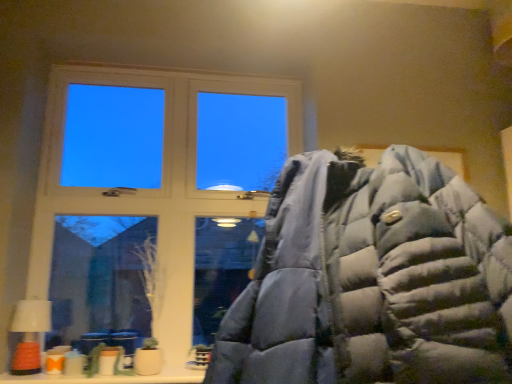
Question: From a real-world perspective, is orange matte lampshade at lower left above or below matte blue puffer jacket at center?

Choices:
 (A) above
 (B) below

Answer: (B)

Question: Based on their sizes in the image, would you say orange matte lampshade at lower left is bigger or smaller than matte blue puffer jacket at center?

Choices:
 (A) small
 (B) big

Answer: (A)

Question: Which of these objects is positioned farthest from the white wood window at upper left?

Choices:
 (A) orange matte lampshade at lower left
 (B) matte blue puffer jacket at center

Answer: (B)

Question: Estimate the real-world distances between objects in this image. Which object is closer to the matte blue puffer jacket at center?

Choices:
 (A) orange matte lampshade at lower left
 (B) white wood window at upper left

Answer: (B)